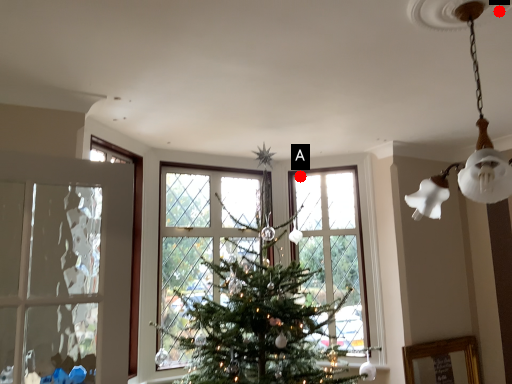
Question: Two points are circled on the image, labeled by A and B beside each circle. Which point appears closest to the camera in this image?

Choices:
 (A) A is closer
 (B) B is closer

Answer: (B)